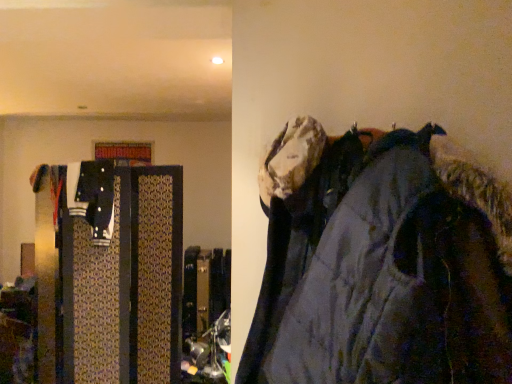
Question: From a real-world perspective, is dark gray fabric jacket at right located beneath patterned fabric suitcase at left?

Choices:
 (A) yes
 (B) no

Answer: (B)

Question: Is the surface of dark gray fabric jacket at right in direct contact with patterned fabric suitcase at left?

Choices:
 (A) no
 (B) yes

Answer: (A)

Question: Does dark gray fabric jacket at right have a lesser height compared to patterned fabric suitcase at left?

Choices:
 (A) no
 (B) yes

Answer: (B)

Question: From the image's perspective, is dark gray fabric jacket at right over patterned fabric suitcase at left?

Choices:
 (A) yes
 (B) no

Answer: (A)

Question: Is dark gray fabric jacket at right oriented away from patterned fabric suitcase at left?

Choices:
 (A) yes
 (B) no

Answer: (B)

Question: From the image's perspective, is dark gray fabric jacket at right under patterned fabric suitcase at left?

Choices:
 (A) yes
 (B) no

Answer: (B)

Question: Considering the relative sizes of patterned fabric suitcase at left and dark gray fabric jacket at right in the image provided, is patterned fabric suitcase at left wider than dark gray fabric jacket at right?

Choices:
 (A) yes
 (B) no

Answer: (B)

Question: Does patterned fabric suitcase at left have a larger size compared to dark gray fabric jacket at right?

Choices:
 (A) no
 (B) yes

Answer: (B)

Question: Does patterned fabric suitcase at left lie behind dark gray fabric jacket at right?

Choices:
 (A) no
 (B) yes

Answer: (B)

Question: From the image's perspective, is patterned fabric suitcase at left located above dark gray fabric jacket at right?

Choices:
 (A) yes
 (B) no

Answer: (B)

Question: Is the surface of patterned fabric suitcase at left in direct contact with dark gray fabric jacket at right?

Choices:
 (A) yes
 (B) no

Answer: (B)

Question: Is patterned fabric suitcase at left not close to dark gray fabric jacket at right?

Choices:
 (A) yes
 (B) no

Answer: (A)

Question: Looking at their shapes, would you say patterned fabric suitcase at left is wider or thinner than dark gray fabric jacket at right?

Choices:
 (A) thin
 (B) wide

Answer: (A)